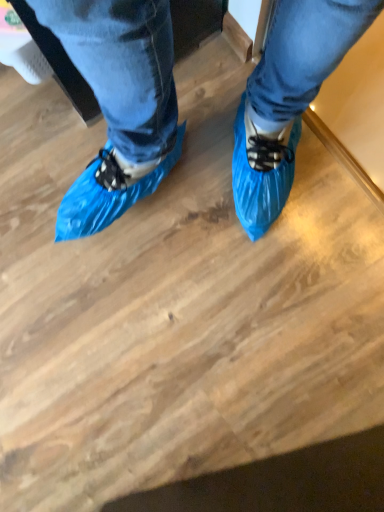
Describe the element at coordinates (122, 66) in the screenshot. I see `denim at center` at that location.

This screenshot has width=384, height=512. Identify the location of denim at center. (122, 66).

In order to click on denim at center in this screenshot , I will do `click(122, 66)`.